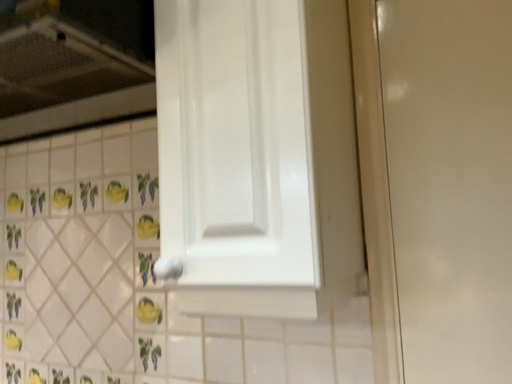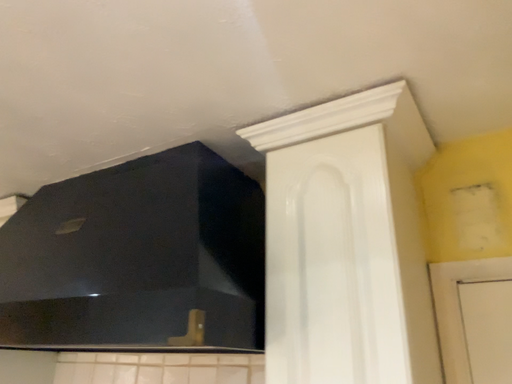
Question: Which way did the camera rotate in the video?

Choices:
 (A) rotated downward
 (B) rotated upward

Answer: (B)